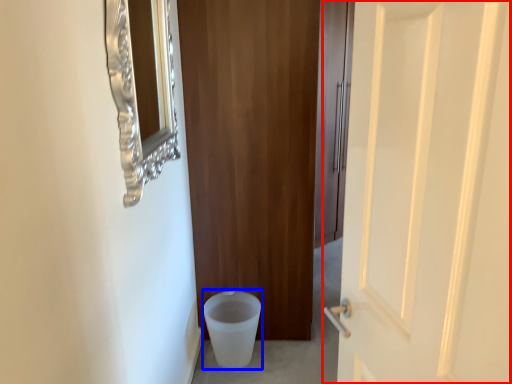
Question: Which point is further to the camera, door (highlighted by a red box) or potty (highlighted by a blue box)?

Choices:
 (A) door
 (B) potty

Answer: (B)